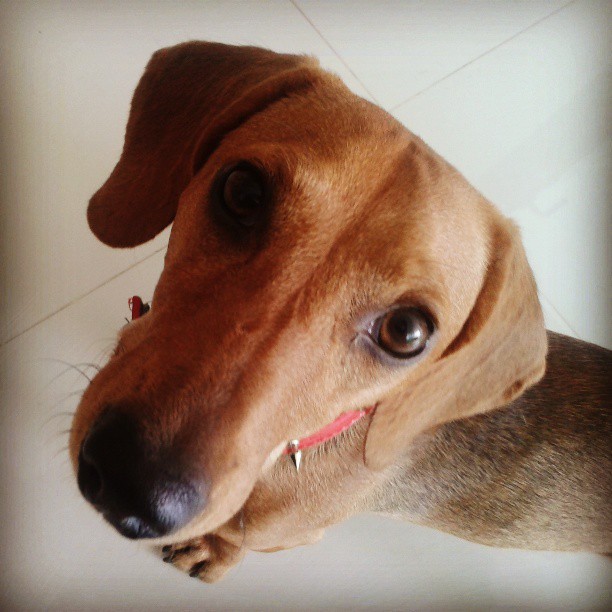
Find the location of a particular element. tile floors is located at coordinates (536, 78), (65, 318), (431, 62), (31, 73), (316, 565).